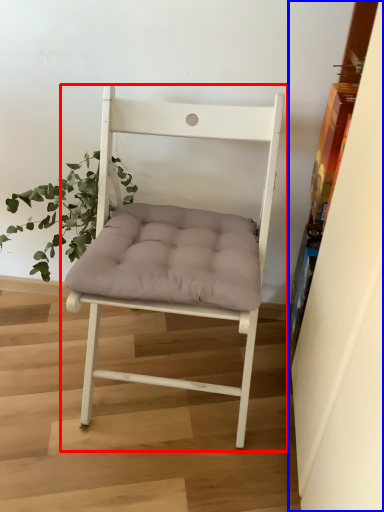
Question: Which of the following is the closest to the observer, chair (highlighted by a red box) or shelf (highlighted by a blue box)?

Choices:
 (A) chair
 (B) shelf

Answer: (B)